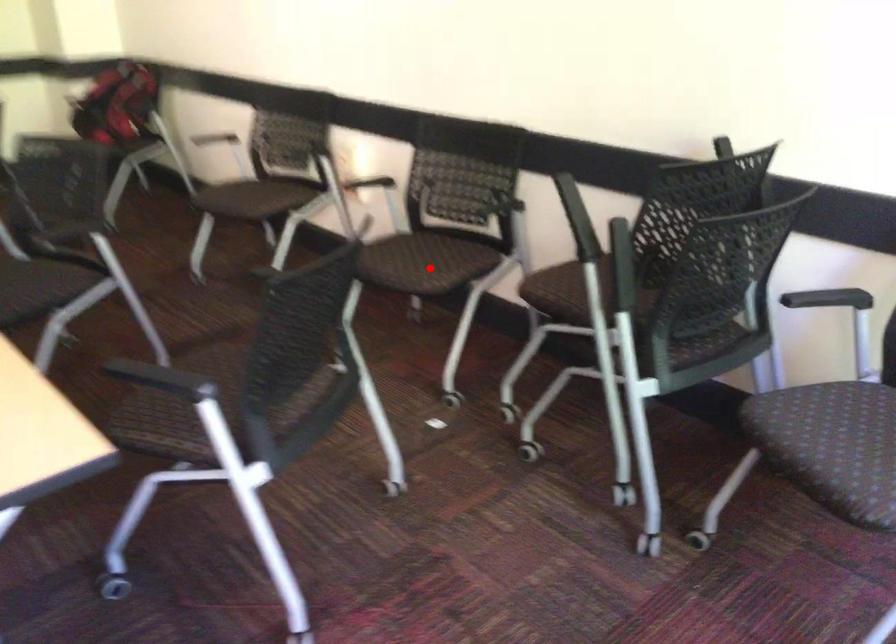
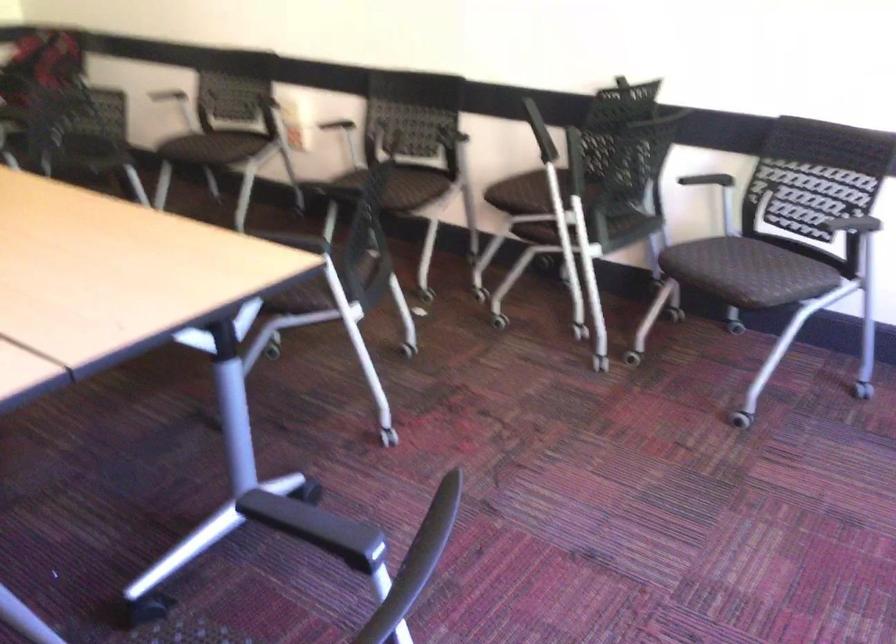
Question: I am providing you with two images of the same scene from different viewpoints. Image1 has a red point marked. In image2, the corresponding 3D location appears at what relative position? Reply with the corresponding letter.

Choices:
 (A) Closer
 (B) Farther

Answer: (B)